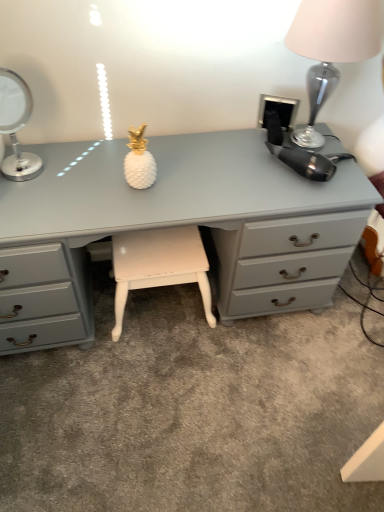
Question: Can you confirm if silver metallic table lamp at left, marked as the second table lamp in a right-to-left arrangement, is smaller than metallic silver table lamp at upper right, the 2th table lamp from the left?

Choices:
 (A) no
 (B) yes

Answer: (B)

Question: From the image's perspective, would you say silver metallic table lamp at left, which appears as the 1th table lamp when viewed from the left, is positioned over metallic silver table lamp at upper right, the 2th table lamp from the left?

Choices:
 (A) yes
 (B) no

Answer: (B)

Question: Is silver metallic table lamp at left, which appears as the 1th table lamp when viewed from the left, positioned behind metallic silver table lamp at upper right, the 2th table lamp from the left?

Choices:
 (A) yes
 (B) no

Answer: (A)

Question: Can you see silver metallic table lamp at left, which appears as the 1th table lamp when viewed from the left, touching metallic silver table lamp at upper right, the 2th table lamp from the left?

Choices:
 (A) no
 (B) yes

Answer: (A)

Question: Could metallic silver table lamp at upper right, the 2th table lamp from the left, be considered to be inside silver metallic table lamp at left, marked as the second table lamp in a right-to-left arrangement?

Choices:
 (A) yes
 (B) no

Answer: (B)

Question: Is silver metallic table lamp at left, marked as the second table lamp in a right-to-left arrangement, outside metallic silver table lamp at upper right, the 2th table lamp from the left?

Choices:
 (A) no
 (B) yes

Answer: (B)

Question: From the image's perspective, is white painted wood stool at center located above silver metallic table lamp at left, which appears as the 1th table lamp when viewed from the left?

Choices:
 (A) no
 (B) yes

Answer: (A)

Question: Could you tell me if white painted wood stool at center is facing silver metallic table lamp at left, which appears as the 1th table lamp when viewed from the left?

Choices:
 (A) yes
 (B) no

Answer: (B)

Question: Is silver metallic table lamp at left, which appears as the 1th table lamp when viewed from the left, a part of white painted wood stool at center?

Choices:
 (A) yes
 (B) no

Answer: (B)

Question: Is white painted wood stool at center positioned with its back to silver metallic table lamp at left, marked as the second table lamp in a right-to-left arrangement?

Choices:
 (A) no
 (B) yes

Answer: (A)

Question: Does white painted wood stool at center have a lesser height compared to silver metallic table lamp at left, marked as the second table lamp in a right-to-left arrangement?

Choices:
 (A) yes
 (B) no

Answer: (B)

Question: Is white painted wood stool at center bigger than silver metallic table lamp at left, which appears as the 1th table lamp when viewed from the left?

Choices:
 (A) no
 (B) yes

Answer: (B)

Question: Is matte gray desk at center shorter than metallic silver table lamp at upper right, the 2th table lamp from the left?

Choices:
 (A) yes
 (B) no

Answer: (B)